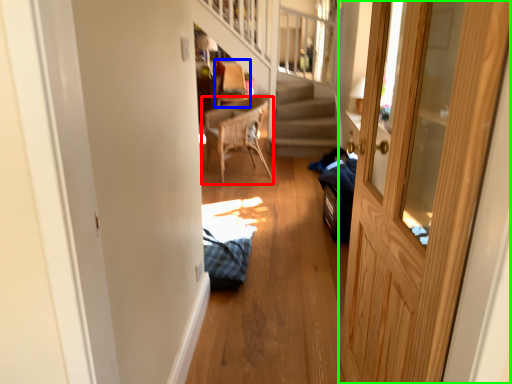
Question: Based on their relative distances, which object is nearer to chair (highlighted by a red box)? Choose from armchair (highlighted by a blue box) and door (highlighted by a green box).

Choices:
 (A) armchair
 (B) door

Answer: (A)